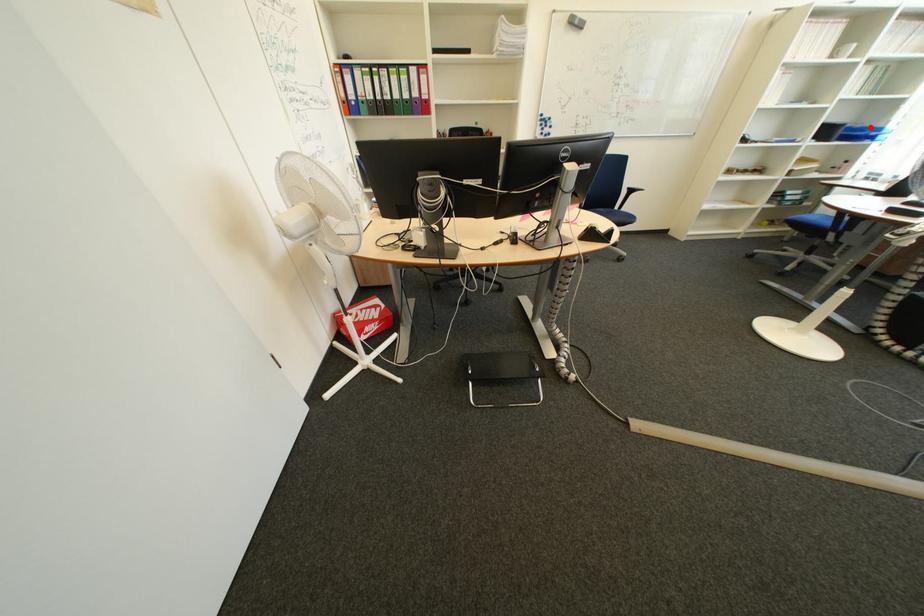
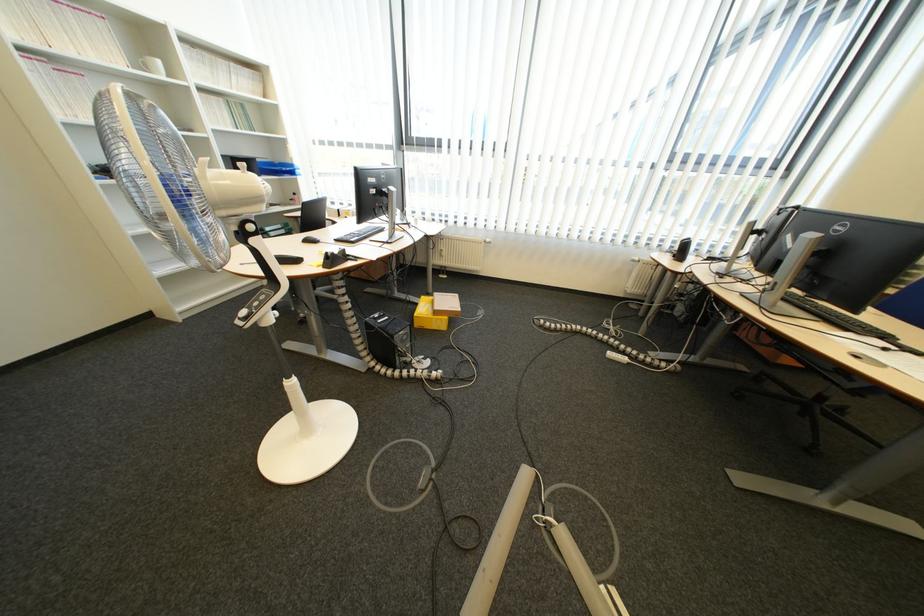
Question: I am providing you with two images of the same scene from different viewpoints. Image1 has a red point marked. In image2, the corresponding 3D location appears at what relative position? Reply with the corresponding letter.

Choices:
 (A) Closer
 (B) Farther

Answer: (A)